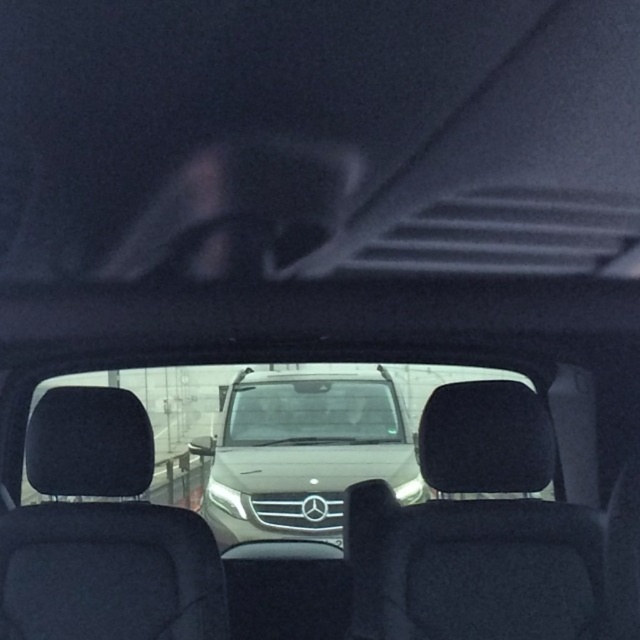
You are a driver in a car with a 20 inch long trunk. You need to place a box that is exactly the same length as the distance between the satin gold suv at center and the black metallic license plate at center. Will the box fit in your trunk?

The distance between the satin gold suv at center and the black metallic license plate at center is 21.76 inches. Since your trunk is only 20 inches long, the box will not fit in your trunk.

You are driving a car and want to safely change lanes to the right. There is a point at coordinates point (140,449) that you need to consider. Is this point within a safe distance for your vehicle to maneuver? Assume your car requires at least 2 meters of clearance for a safe lane change.

The point at coordinates point (140,449) is 2.45 meters away from the viewer. Since this distance is greater than the required 2 meters of clearance, the point is within a safe distance for the vehicle to maneuver.